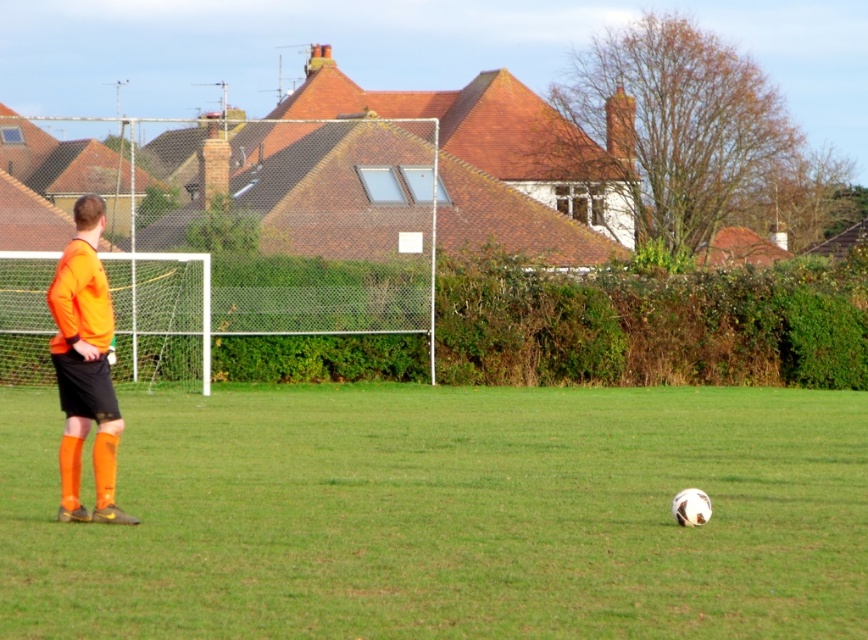
Question: In this image, where is green grass at center located relative to orange matte jersey at left?

Choices:
 (A) right
 (B) left

Answer: (A)

Question: Can you confirm if green grass at center is wider than orange matte jersey at left?

Choices:
 (A) yes
 (B) no

Answer: (A)

Question: Which of the following is the closest to the observer?

Choices:
 (A) (49, 470)
 (B) (97, 260)

Answer: (B)

Question: Which point is farther to the camera?

Choices:
 (A) (264, 580)
 (B) (63, 362)

Answer: (B)

Question: Is green grass at center positioned before orange matte jersey at left?

Choices:
 (A) no
 (B) yes

Answer: (B)